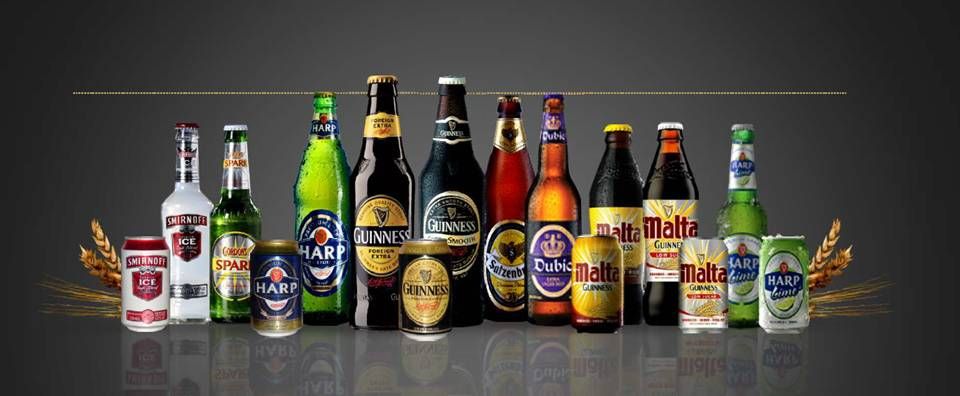
Image resolution: width=960 pixels, height=396 pixels. What are the coordinates of `bottles` in the screenshot? It's located at tap(189, 226), tap(238, 213), tap(316, 203), tap(377, 190), tap(451, 180), tap(519, 178), tap(554, 178), tap(616, 186), tap(663, 186), tap(744, 188).